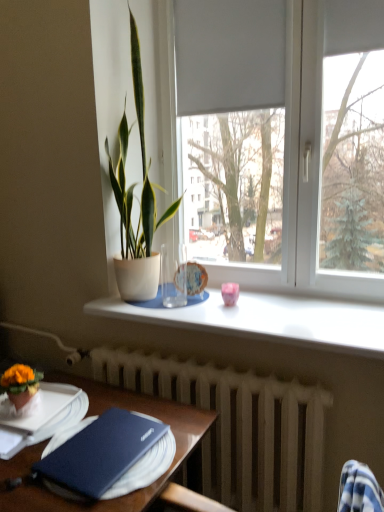
The image size is (384, 512). I want to click on free space above matte blue hardback book at lower left (from a real-world perspective), so click(x=112, y=443).